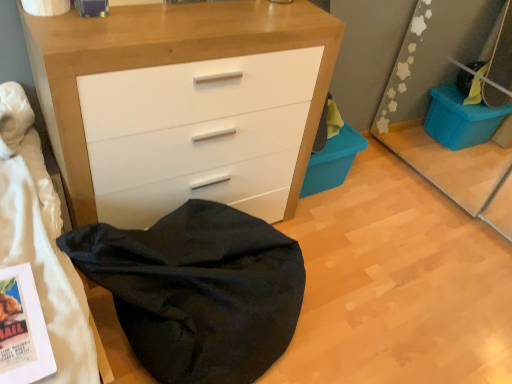
Question: Considering the relative positions of matte white chest of drawers at center and blue plastic storage bin at lower right in the image provided, is matte white chest of drawers at center to the right of blue plastic storage bin at lower right from the viewer's perspective?

Choices:
 (A) no
 (B) yes

Answer: (A)

Question: Does matte white chest of drawers at center have a smaller size compared to blue plastic storage bin at lower right?

Choices:
 (A) yes
 (B) no

Answer: (B)

Question: Is matte white chest of drawers at center outside blue plastic storage bin at lower right?

Choices:
 (A) no
 (B) yes

Answer: (B)

Question: Is matte white chest of drawers at center positioned with its back to blue plastic storage bin at lower right?

Choices:
 (A) yes
 (B) no

Answer: (B)

Question: Is matte white chest of drawers at center at the left side of blue plastic storage bin at lower right?

Choices:
 (A) no
 (B) yes

Answer: (B)

Question: Does matte white chest of drawers at center come behind blue plastic storage bin at lower right?

Choices:
 (A) yes
 (B) no

Answer: (B)

Question: Does blue plastic storage bin at lower right have a lesser height compared to black fabric bean bag at lower left?

Choices:
 (A) no
 (B) yes

Answer: (B)

Question: Is black fabric bean bag at lower left at the back of blue plastic storage bin at lower right?

Choices:
 (A) no
 (B) yes

Answer: (A)

Question: Considering the relative sizes of blue plastic storage bin at lower right and black fabric bean bag at lower left in the image provided, is blue plastic storage bin at lower right bigger than black fabric bean bag at lower left?

Choices:
 (A) yes
 (B) no

Answer: (B)

Question: Is blue plastic storage bin at lower right in front of black fabric bean bag at lower left?

Choices:
 (A) no
 (B) yes

Answer: (A)

Question: Is blue plastic storage bin at lower right thinner than black fabric bean bag at lower left?

Choices:
 (A) no
 (B) yes

Answer: (B)

Question: Is blue plastic storage bin at lower right smaller than black fabric bean bag at lower left?

Choices:
 (A) yes
 (B) no

Answer: (A)

Question: Does black fabric bean bag at lower left turn towards matte white chest of drawers at center?

Choices:
 (A) no
 (B) yes

Answer: (A)